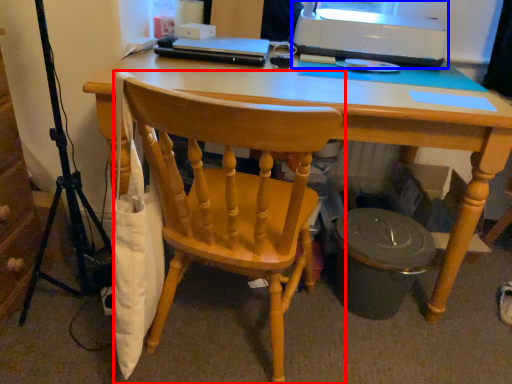
Question: Which object appears farthest to the camera in this image, chair (highlighted by a red box) or printer (highlighted by a blue box)?

Choices:
 (A) chair
 (B) printer

Answer: (B)